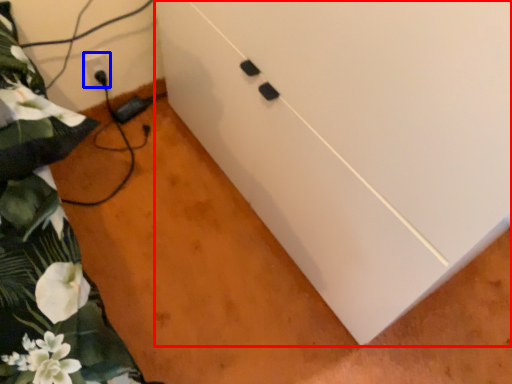
Question: Which object is closer to the camera taking this photo, cabinetry (highlighted by a red box) or electric outlet (highlighted by a blue box)?

Choices:
 (A) cabinetry
 (B) electric outlet

Answer: (A)